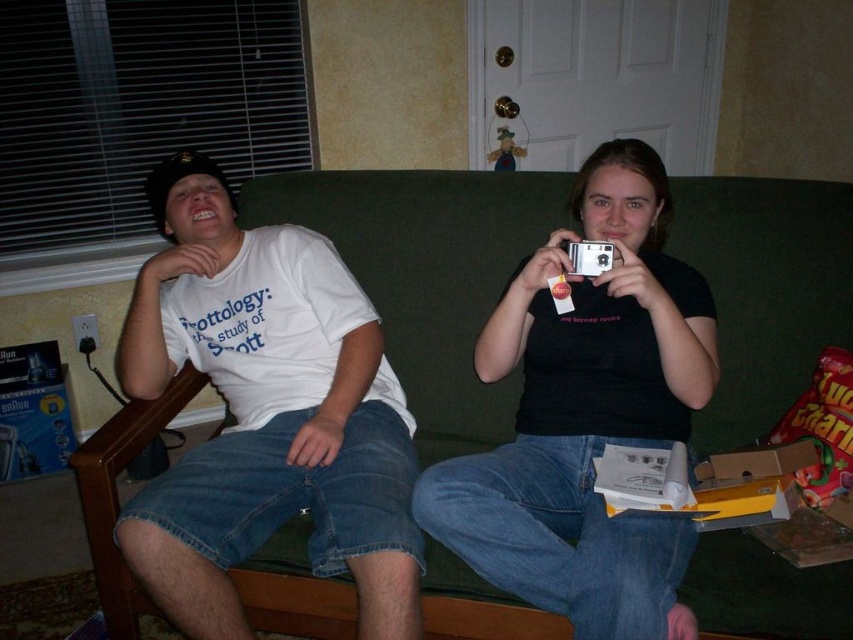
Question: Can you confirm if white matte t-shirt at left is thinner than black matte camera at center?

Choices:
 (A) yes
 (B) no

Answer: (B)

Question: Estimate the real-world distances between objects in this image. Which object is farther from the black matte camera at center?

Choices:
 (A) white matte t-shirt at left
 (B) green fabric couch at center

Answer: (A)

Question: Which point is closer to the camera?

Choices:
 (A) white matte t-shirt at left
 (B) green fabric couch at center
 (C) black matte camera at center

Answer: (C)

Question: Estimate the real-world distances between objects in this image. Which object is closer to the white matte t-shirt at left?

Choices:
 (A) green fabric couch at center
 (B) black matte camera at center

Answer: (A)

Question: Is green fabric couch at center above white matte t-shirt at left?

Choices:
 (A) yes
 (B) no

Answer: (A)

Question: Is white matte t-shirt at left to the left of black matte camera at center from the viewer's perspective?

Choices:
 (A) no
 (B) yes

Answer: (B)